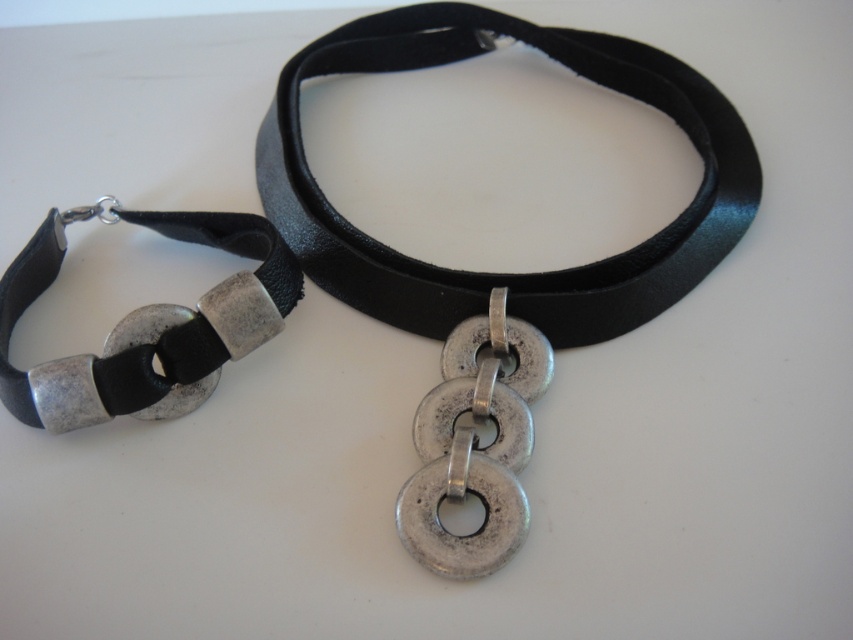
Question: Is black leather strap at left closer to the viewer compared to silver metallic chain at center?

Choices:
 (A) no
 (B) yes

Answer: (A)

Question: Does black leather choker at center have a lesser width compared to silver metallic chain at center?

Choices:
 (A) no
 (B) yes

Answer: (A)

Question: Which is nearer to the black leather strap at left?

Choices:
 (A) silver metallic chain at center
 (B) black leather choker at center

Answer: (B)

Question: Considering the real-world distances, which object is farthest from the black leather choker at center?

Choices:
 (A) silver metallic chain at center
 (B) black leather strap at left

Answer: (B)

Question: Which of the following is the farthest from the observer?

Choices:
 (A) (146, 353)
 (B) (466, 492)
 (C) (378, 48)

Answer: (C)

Question: Is black leather strap at left bigger than silver metallic chain at center?

Choices:
 (A) yes
 (B) no

Answer: (A)